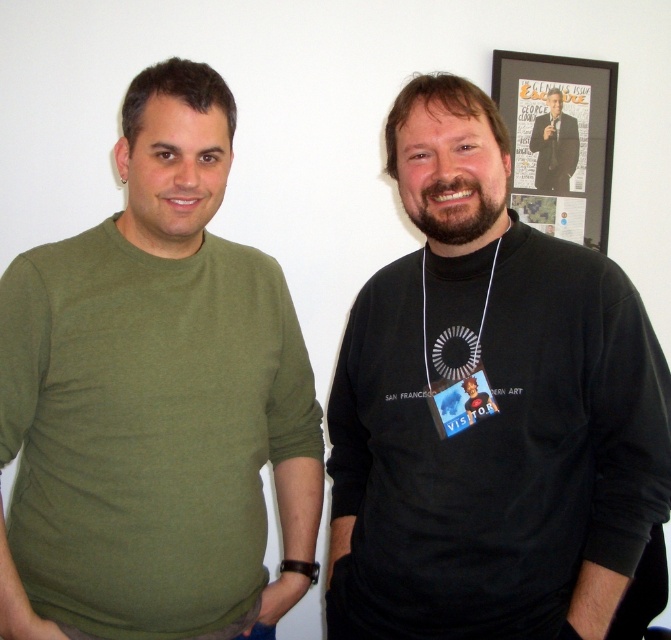
Does point (391, 497) lie behind point (560, 184)?

No, (391, 497) is closer to viewer.

Who is positioned more to the right, black matte t-shirt at center or matte black suit at upper center?

Positioned to the right is matte black suit at upper center.

The width and height of the screenshot is (671, 640). Describe the element at coordinates (488, 408) in the screenshot. I see `black matte t-shirt at center` at that location.

The height and width of the screenshot is (640, 671). Find the location of `black matte t-shirt at center`. black matte t-shirt at center is located at coordinates (488, 408).

Can you confirm if black matte t-shirt at center is positioned above black framed poster at upper right?

No, black matte t-shirt at center is not above black framed poster at upper right.

Is black matte t-shirt at center shorter than black framed poster at upper right?

In fact, black matte t-shirt at center may be taller than black framed poster at upper right.

Identify the location of black matte t-shirt at center. (488, 408).

Which is in front, point (205, 234) or point (541, 152)?

Point (205, 234)

This screenshot has width=671, height=640. Describe the element at coordinates (154, 401) in the screenshot. I see `olive green t-shirt at left` at that location.

Is point (42, 332) positioned behind point (574, 144)?

No, it is not.

Locate an element on the screen. olive green t-shirt at left is located at coordinates (154, 401).